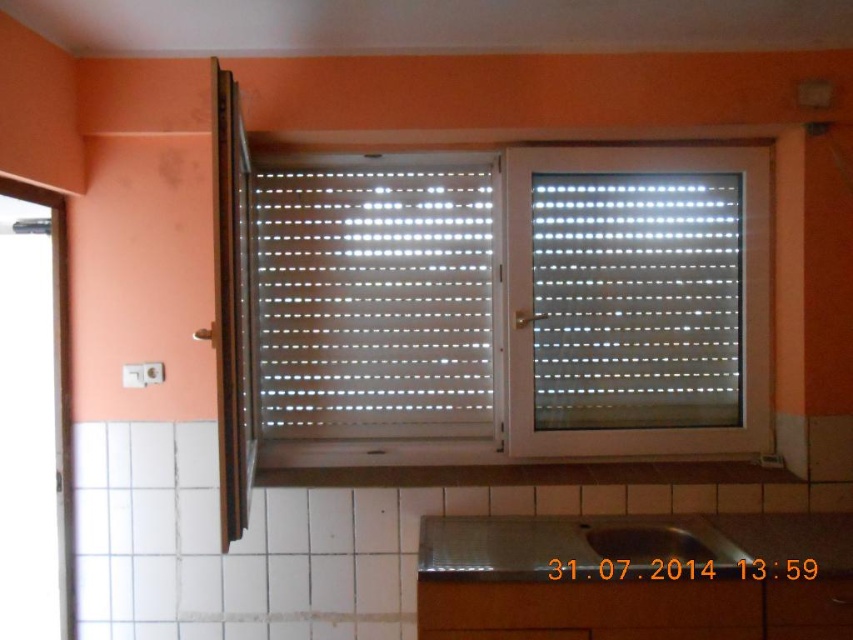
Consider the image. Is white plastic blinds at center taller than matte stainless steel sink at lower center?

Correct, white plastic blinds at center is much taller as matte stainless steel sink at lower center.

Is white plastic blinds at center thinner than matte stainless steel sink at lower center?

In fact, white plastic blinds at center might be wider than matte stainless steel sink at lower center.

Who is more distant from viewer, (576, 378) or (648, 534)?

Point (576, 378)

The width and height of the screenshot is (853, 640). Find the location of `white plastic blinds at center`. white plastic blinds at center is located at coordinates (636, 300).

This screenshot has width=853, height=640. Describe the element at coordinates (374, 300) in the screenshot. I see `white plastic blind at center` at that location.

Is white plastic blind at center wider than matte stainless steel sink at lower center?

Yes, white plastic blind at center is wider than matte stainless steel sink at lower center.

The width and height of the screenshot is (853, 640). I want to click on white plastic blind at center, so click(x=374, y=300).

Is point (370, 385) positioned after point (791, 580)?

Yes, it is behind point (791, 580).

Measure the distance between white plastic blind at center and camera.

2.41 meters

Is point (422, 211) farther from camera compared to point (451, 632)?

That is True.

This screenshot has height=640, width=853. Find the location of `white plastic blind at center`. white plastic blind at center is located at coordinates (374, 300).